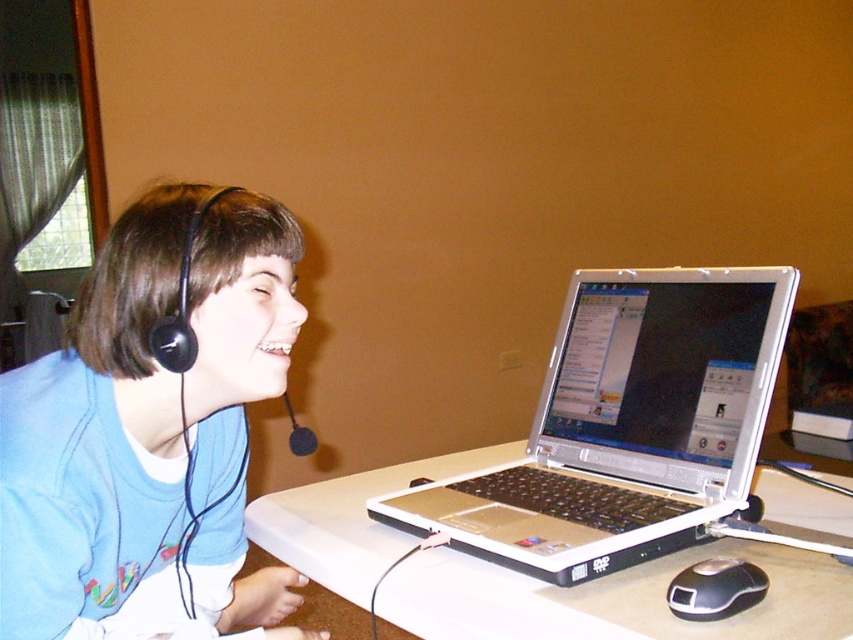
Question: Is silver metallic laptop at center closer to the viewer compared to white plastic table at center?

Choices:
 (A) yes
 (B) no

Answer: (B)

Question: Is matte blue shirt at left to the right of silver metallic laptop at center from the viewer's perspective?

Choices:
 (A) no
 (B) yes

Answer: (A)

Question: Which point is farther from the camera taking this photo?

Choices:
 (A) (581, 282)
 (B) (737, 573)

Answer: (A)

Question: Is silver metallic laptop at center above white plastic table at center?

Choices:
 (A) no
 (B) yes

Answer: (B)

Question: Which point appears closest to the camera in this image?

Choices:
 (A) (134, 488)
 (B) (625, 550)
 (C) (709, 616)

Answer: (C)

Question: Based on their relative distances, which object is nearer to the black glossy mouse at lower right?

Choices:
 (A) black matte microphone at left
 (B) white plastic table at center

Answer: (B)